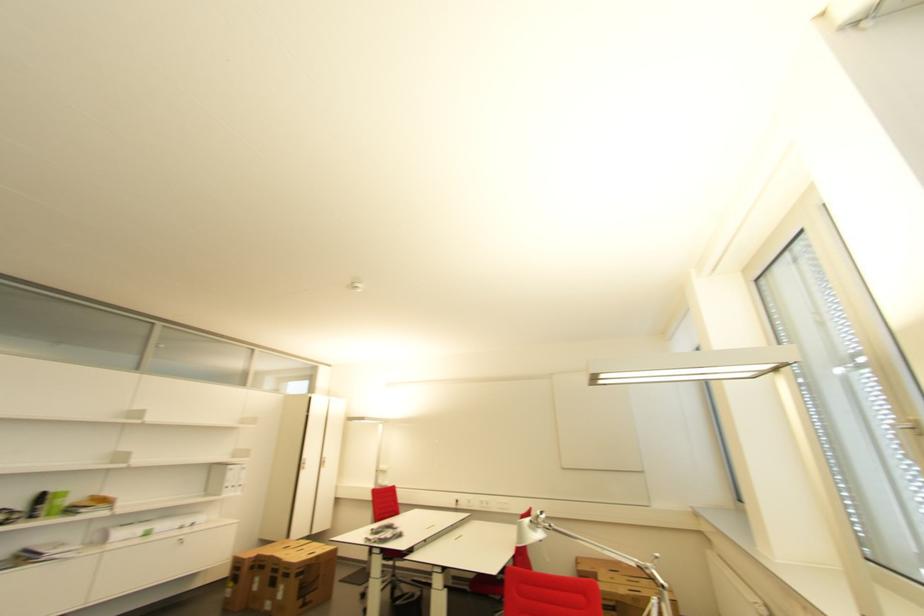
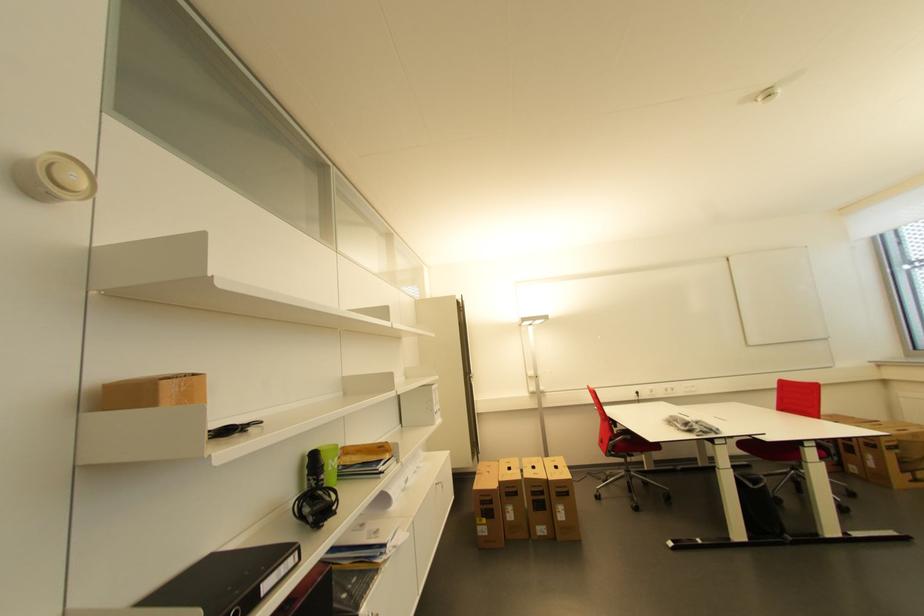
The images are taken continuously from a first-person perspective. In which direction are you moving?

The cameraman moved toward left, forward.